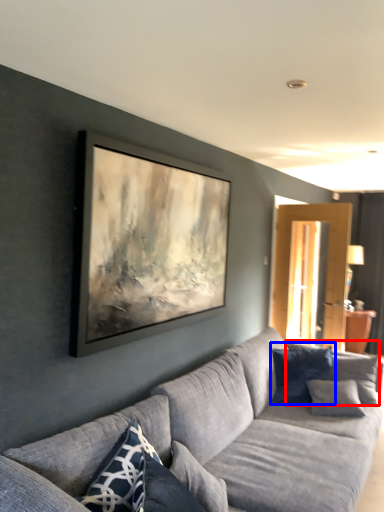
Question: Which object is closer to the camera taking this photo, pillow (highlighted by a red box) or pillow (highlighted by a blue box)?

Choices:
 (A) pillow
 (B) pillow

Answer: (A)